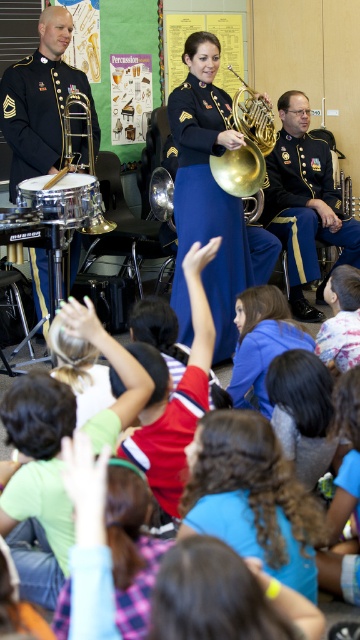
Does point (258, 294) come in front of point (241, 186)?

Yes, point (258, 294) is closer to viewer.

This screenshot has height=640, width=360. In order to click on blue fabric shirt at center in this screenshot , I will do `click(262, 340)`.

Based on the photo, between brushed silver drum at left and shiny brass trumpet at left, which one has less height?

Standing shorter between the two is brushed silver drum at left.

Is point (96, 200) in front of point (115, 224)?

Yes, it is.

Locate an element on the screen. This screenshot has width=360, height=640. brushed silver drum at left is located at coordinates (65, 198).

Which is behind, point (273, 333) or point (59, 177)?

The point (59, 177) is behind.

Does blue fabric shirt at center lie behind shiny brass trumpet at left?

That is False.

The width and height of the screenshot is (360, 640). What do you see at coordinates (262, 340) in the screenshot?
I see `blue fabric shirt at center` at bounding box center [262, 340].

Locate an element on the screen. Image resolution: width=360 pixels, height=640 pixels. blue fabric shirt at center is located at coordinates (262, 340).